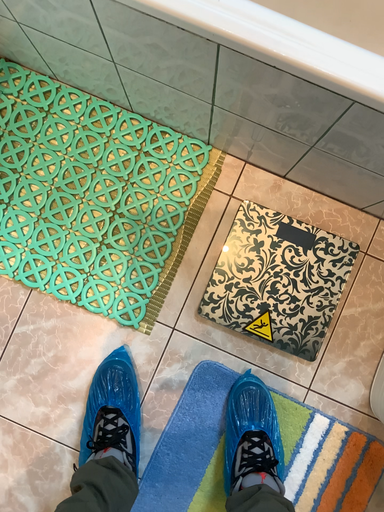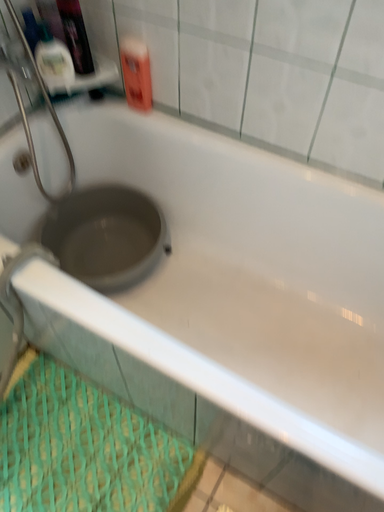
Question: How did the camera likely rotate when shooting the video?

Choices:
 (A) rotated downward
 (B) rotated upward

Answer: (B)